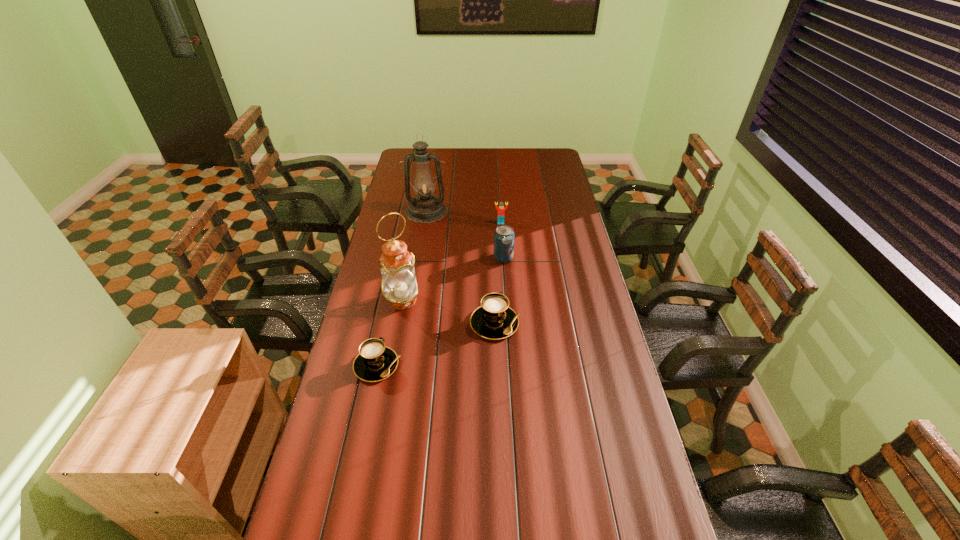
Locate an element on the screen. vacant space situated 0.180m on the left of the taller cappuccino is located at coordinates (420, 323).

Where is `free location located on the face of the Lego`? This screenshot has width=960, height=540. free location located on the face of the Lego is located at coordinates (502, 238).

Identify the location of vacant position located 0.190m on the front of the farther oil lamp. (420, 249).

Image resolution: width=960 pixels, height=540 pixels. Find the location of `free space located 0.270m on the right of the fourth shortest object`. free space located 0.270m on the right of the fourth shortest object is located at coordinates (578, 258).

Where is `free space located on the front of the nearer oil lamp`? free space located on the front of the nearer oil lamp is located at coordinates (398, 322).

The width and height of the screenshot is (960, 540). In order to click on cappuccino that is at the left edge in this screenshot , I will do `click(375, 362)`.

This screenshot has width=960, height=540. Find the location of `free spot at the far edge of the desktop`. free spot at the far edge of the desktop is located at coordinates pos(494,155).

The width and height of the screenshot is (960, 540). I want to click on blank space at the left edge, so click(363, 316).

At what (x,y) coordinates should I click in order to perform the action: click on free spot at the right edge of the desktop. Please return your answer as a coordinate pair (x, y). The width and height of the screenshot is (960, 540). Looking at the image, I should click on (582, 427).

In the image, there is a desktop. In order to click on vacant space at the far left corner in this screenshot , I will do `click(404, 157)`.